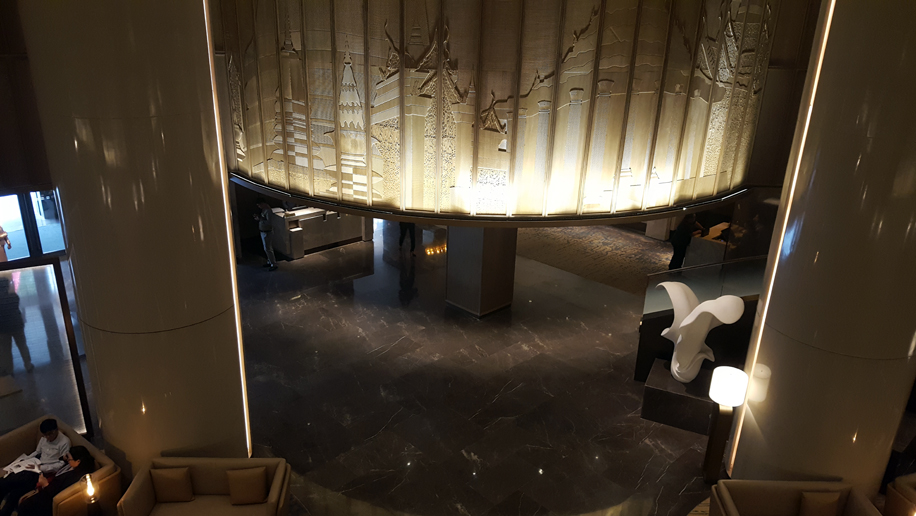
Find the location of a particular element. window is located at coordinates (51, 237), (17, 240).